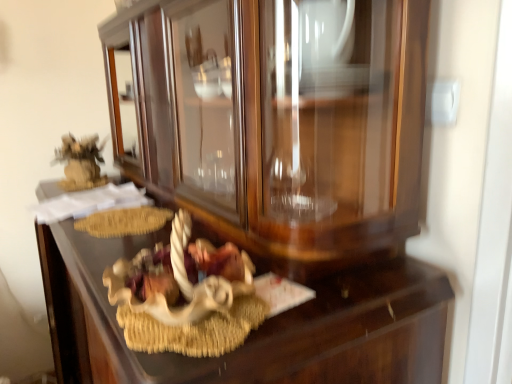
You are a GUI agent. You are given a task and a screenshot of the screen. Output one action in this format:
    pyautogui.click(x=<x>, y=<y>)
    Task: Click on the vacant location below white matte nativity scene at center (from a real-world perspective)
    The height and width of the screenshot is (384, 512).
    Given the screenshot: What is the action you would take?
    pyautogui.click(x=178, y=324)